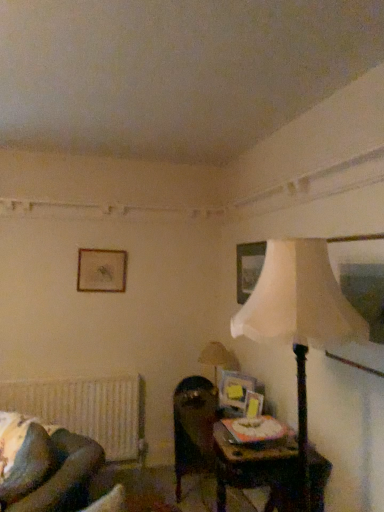
Question: Is matte beige lampshade at right, the 1th lamp positioned from the back, turned away from wooden picture frame at upper center, which is the second picture frame in top-to-bottom order?

Choices:
 (A) yes
 (B) no

Answer: (B)

Question: From the image's perspective, is matte beige lampshade at right, the 1th lamp positioned from the back, beneath wooden picture frame at upper center, which is the second picture frame in top-to-bottom order?

Choices:
 (A) yes
 (B) no

Answer: (A)

Question: Is matte beige lampshade at right, marked as the second lamp in a front-to-back arrangement, at the right side of wooden picture frame at upper center, placed as the fourth picture frame when sorted from left to right?

Choices:
 (A) no
 (B) yes

Answer: (A)

Question: Is matte beige lampshade at right, the 1th lamp positioned from the back, touching wooden picture frame at upper center, positioned as the third picture frame in front-to-back order?

Choices:
 (A) no
 (B) yes

Answer: (A)

Question: Does matte beige lampshade at right, marked as the second lamp in a front-to-back arrangement, have a lesser width compared to wooden picture frame at upper center, positioned as the third picture frame in front-to-back order?

Choices:
 (A) no
 (B) yes

Answer: (A)

Question: Considering the relative positions of matte beige lampshade at right, marked as the second lamp in a front-to-back arrangement, and wooden picture frame at upper center, which is the second picture frame in top-to-bottom order, in the image provided, is matte beige lampshade at right, marked as the second lamp in a front-to-back arrangement, to the left of wooden picture frame at upper center, which is the second picture frame in top-to-bottom order, from the viewer's perspective?

Choices:
 (A) no
 (B) yes

Answer: (B)

Question: From a real-world perspective, does matte gold picture frame at upper center, which is the 1th picture frame from back to front, sit lower than matte beige lampshade at right, the 1th lamp positioned from the back?

Choices:
 (A) no
 (B) yes

Answer: (A)

Question: Can you confirm if matte gold picture frame at upper center, which is counted as the 4th picture frame, starting from the bottom, is smaller than matte beige lampshade at right, the 1th lamp positioned from the back?

Choices:
 (A) no
 (B) yes

Answer: (B)

Question: From the image's perspective, is matte gold picture frame at upper center, which is the 1th picture frame from back to front, on top of matte beige lampshade at right, the 1th lamp positioned from the back?

Choices:
 (A) no
 (B) yes

Answer: (B)

Question: Considering the relative sizes of matte gold picture frame at upper center, acting as the first picture frame starting from the left, and matte beige lampshade at right, marked as the second lamp in a front-to-back arrangement, in the image provided, is matte gold picture frame at upper center, acting as the first picture frame starting from the left, shorter than matte beige lampshade at right, marked as the second lamp in a front-to-back arrangement,?

Choices:
 (A) no
 (B) yes

Answer: (B)

Question: Is matte gold picture frame at upper center, acting as the first picture frame starting from the left, oriented towards matte beige lampshade at right, the 1th lamp positioned from the back?

Choices:
 (A) no
 (B) yes

Answer: (A)

Question: From a real-world perspective, is matte gold picture frame at upper center, which is the 1th picture frame from back to front, over matte beige lampshade at right, marked as the second lamp in a front-to-back arrangement?

Choices:
 (A) no
 (B) yes

Answer: (B)

Question: Does dark brown leather swivel chair at center have a greater height compared to dark brown leather rocking chair at lower left?

Choices:
 (A) yes
 (B) no

Answer: (A)